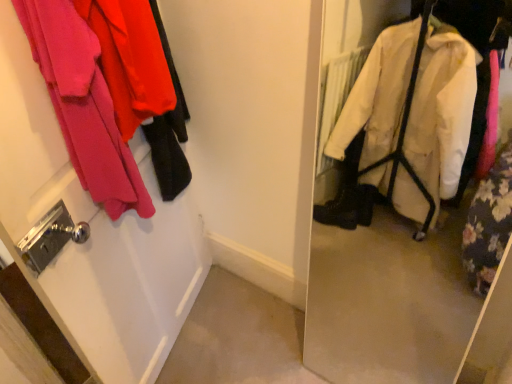
Question: Is matte pink fabric at upper left inside the boundaries of white matte door at left, or outside?

Choices:
 (A) outside
 (B) inside

Answer: (B)

Question: From a real-world perspective, is matte pink fabric at upper left above or below white matte door at left?

Choices:
 (A) above
 (B) below

Answer: (A)

Question: Considering the positions of matte pink fabric at upper left and white matte door at left in the image, is matte pink fabric at upper left taller or shorter than white matte door at left?

Choices:
 (A) short
 (B) tall

Answer: (A)

Question: From the image's perspective, is white matte door at left positioned above or below matte pink fabric at upper left?

Choices:
 (A) above
 (B) below

Answer: (B)

Question: Considering the positions of white matte door at left and matte pink fabric at upper left in the image, is white matte door at left taller or shorter than matte pink fabric at upper left?

Choices:
 (A) tall
 (B) short

Answer: (A)

Question: Relative to matte pink fabric at upper left, is white matte door at left in front or behind?

Choices:
 (A) front
 (B) behind

Answer: (A)

Question: Based on their sizes in the image, would you say white matte door at left is bigger or smaller than matte pink fabric at upper left?

Choices:
 (A) small
 (B) big

Answer: (B)